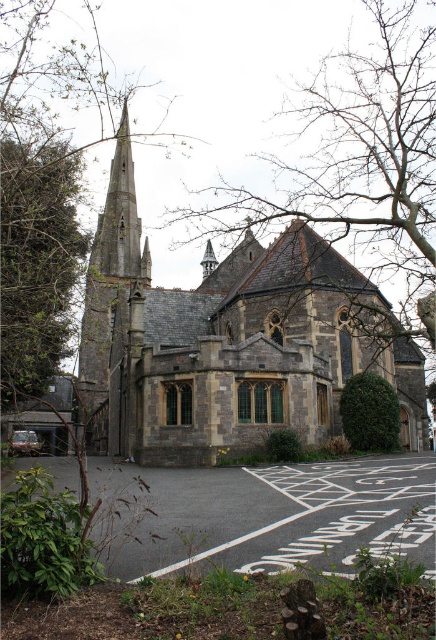
Can you confirm if gray asphalt parking lot at lower center is positioned above dark gray stone steeple at center-left?

Actually, gray asphalt parking lot at lower center is below dark gray stone steeple at center-left.

Can you confirm if gray asphalt parking lot at lower center is wider than dark gray stone steeple at center-left?

Correct, the width of gray asphalt parking lot at lower center exceeds that of dark gray stone steeple at center-left.

Who is more forward, (x=102, y=476) or (x=119, y=234)?

Point (x=102, y=476) is in front.

You are a GUI agent. You are given a task and a screenshot of the screen. Output one action in this format:
    pyautogui.click(x=<x>, y=<y>)
    Task: Click on the gray asphalt parking lot at lower center
    The height and width of the screenshot is (640, 436).
    Given the screenshot: What is the action you would take?
    pyautogui.click(x=285, y=515)

Is stone church at center in front of dark gray stone steeple at center-left?

Yes.

This screenshot has height=640, width=436. What are the coordinates of `stone church at center` in the screenshot? It's located at (228, 340).

Does point (262, 358) come in front of point (41, 257)?

Yes, it is in front of point (41, 257).

Which is more to the left, stone church at center or green leafy tree at left?

green leafy tree at left

Measure the distance between stone church at center and camera.

The distance of stone church at center from camera is 49.03 meters.

At what (x,y) coordinates should I click in order to perform the action: click on stone church at center. Please return your answer as a coordinate pair (x, y). Looking at the image, I should click on (228, 340).